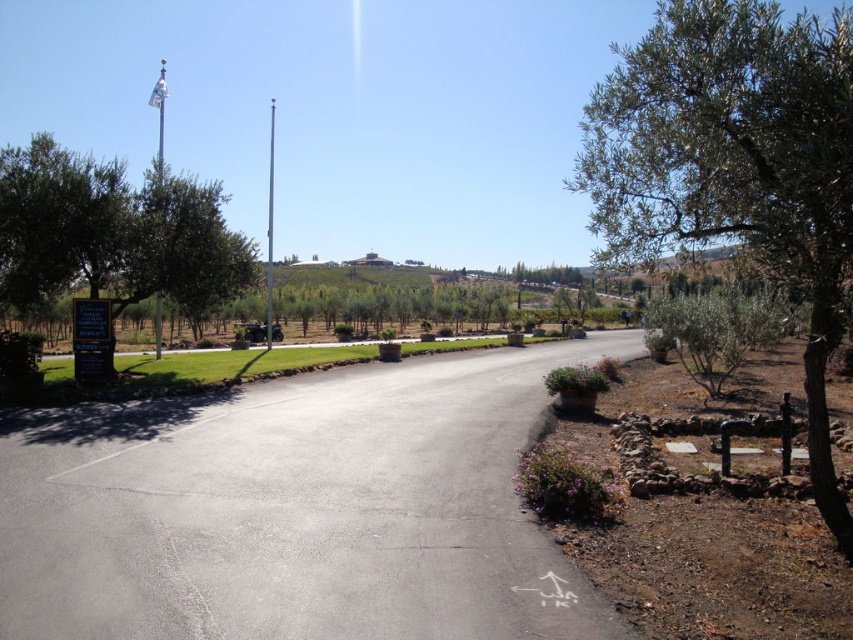
Question: Which object is positioned closest to the green leafy tree at left?

Choices:
 (A) green leafy olive tree at right
 (B) asphalt at center

Answer: (B)

Question: Does asphalt at center come behind green leafy olive tree at right?

Choices:
 (A) yes
 (B) no

Answer: (A)

Question: Is asphalt at center to the left of green leafy tree at left from the viewer's perspective?

Choices:
 (A) no
 (B) yes

Answer: (A)

Question: Which point is closer to the camera?

Choices:
 (A) green leafy olive tree at right
 (B) green leafy tree at left

Answer: (A)

Question: Can you confirm if asphalt at center is smaller than green leafy tree at left?

Choices:
 (A) no
 (B) yes

Answer: (B)

Question: Which point appears closest to the camera in this image?

Choices:
 (A) (45, 518)
 (B) (41, 211)
 (C) (778, 275)

Answer: (C)